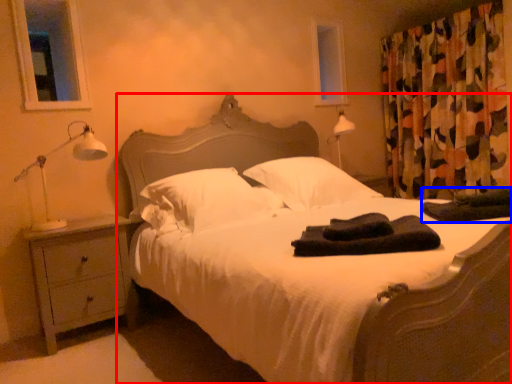
Question: Which object appears closest to the camera in this image, bed (highlighted by a red box) or material (highlighted by a blue box)?

Choices:
 (A) bed
 (B) material

Answer: (A)